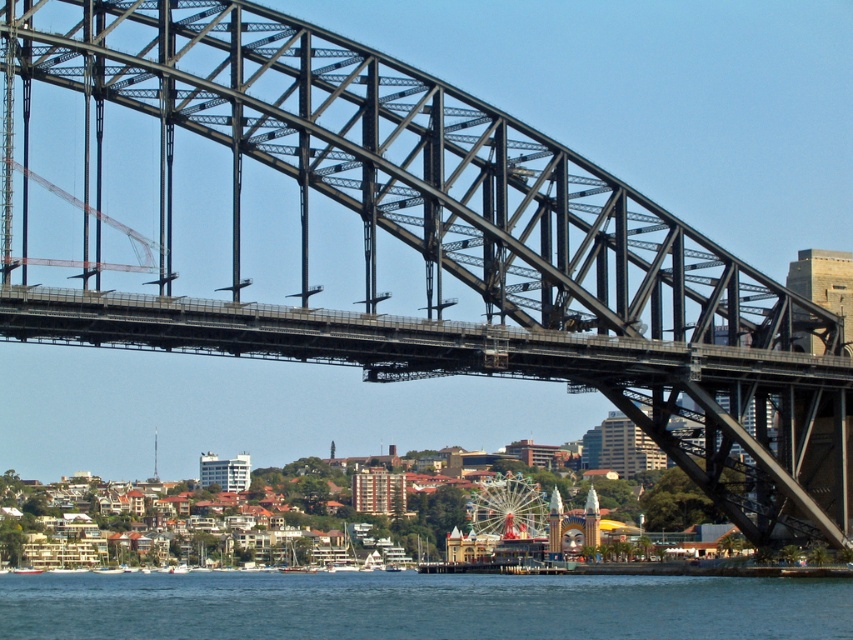
You are a tourist standing on the Sydney Harbour Bridge and looking down. You see the blue water at lower center and the metallic ferris wheel at center. Which object is located directly below the other?

The blue water at lower center is positioned under the metallic ferris wheel at center.

You are planning to take a photo of the Sydney Harbour Bridge with both the blue water at lower center and the metallic ferris wheel at center in the frame. Which object should you position closer to the edge of the frame to ensure both fit properly?

Since the blue water at lower center is wider than the metallic ferris wheel at center, you should position the blue water at lower center closer to the edge of the frame to make space for both objects.

You are standing on the Sydney Harbour Bridge and looking down. You see the blue water at lower center and the metallic ferris wheel at center. Which one is positioned to the left of the other?

The blue water at lower center is positioned to the left of the metallic ferris wheel at center.